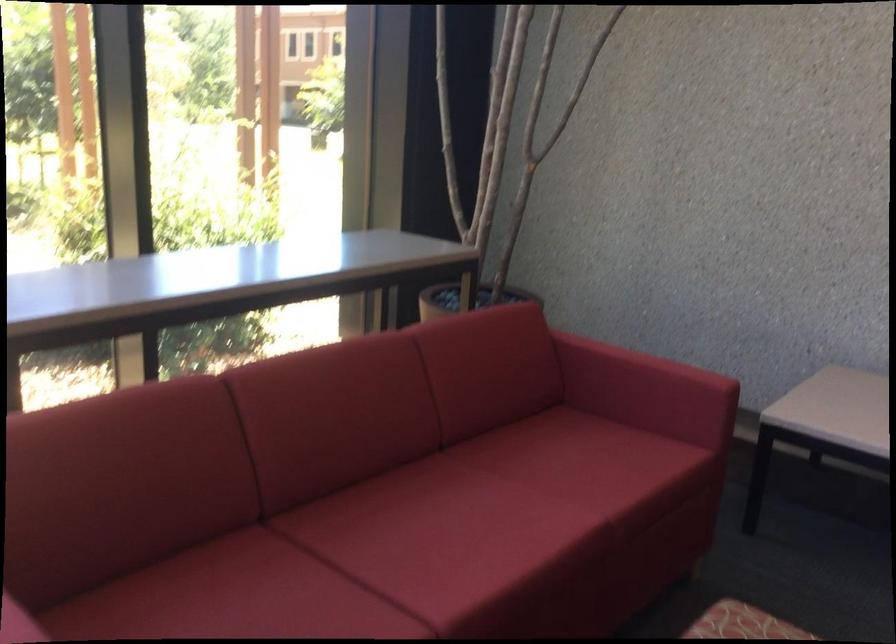
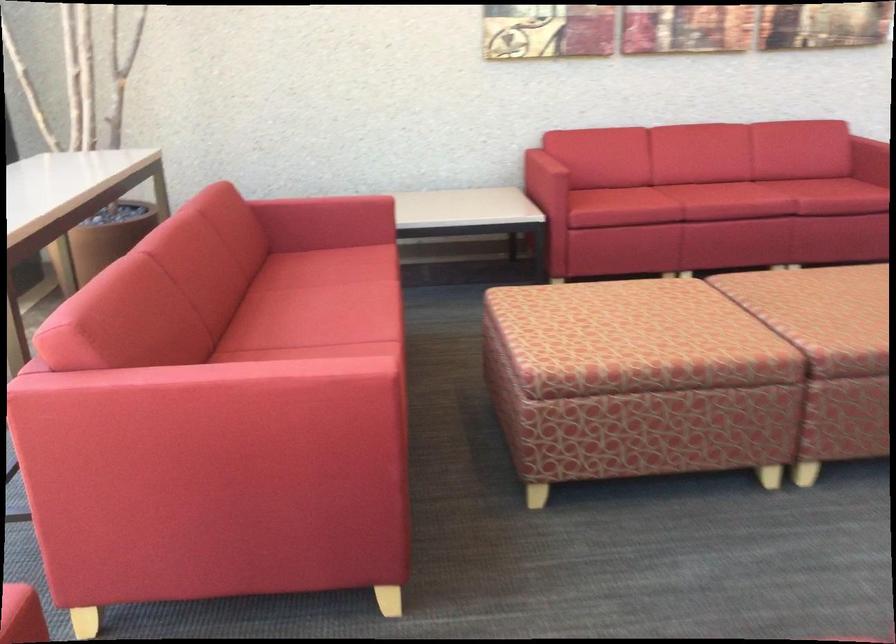
The point at (636, 374) is marked in the first image. Where is the corresponding point in the second image?

(326, 207)